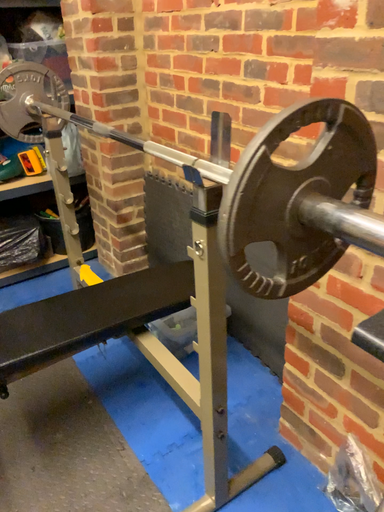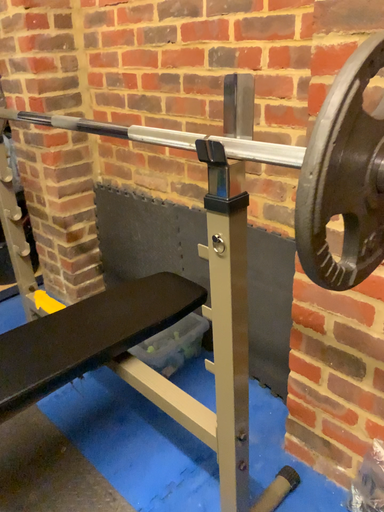
Question: Which way did the camera rotate in the video?

Choices:
 (A) rotated right
 (B) rotated left

Answer: (A)